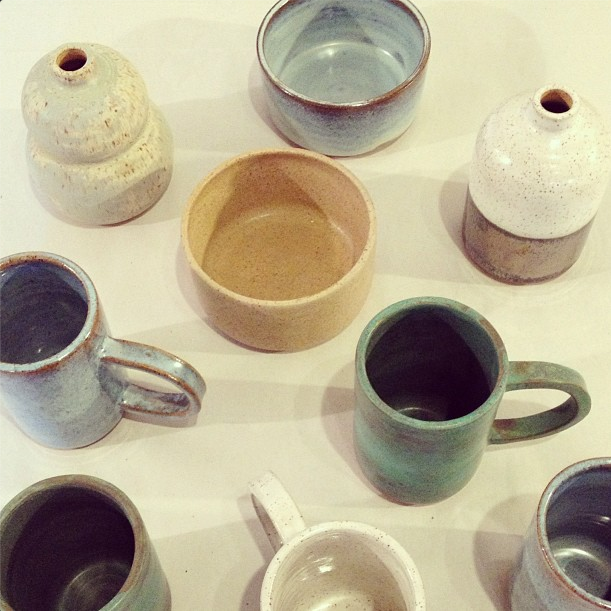
Find the location of a particular element. table is located at coordinates (268, 439).